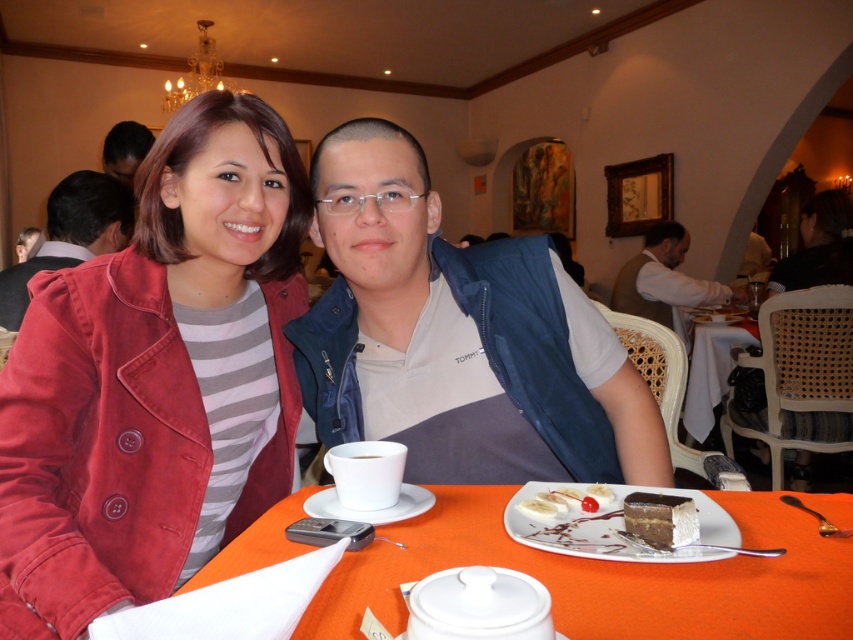
You are a photographer standing at the camera position. You want to place a small decorative item on the table so that it is exactly 30 inches away from the camera. Given the current setup, can you place the item in front of the white ceramic plate at lower center?

The white ceramic plate at lower center is currently 27.77 inches away from the camera. To place the decorative item 30 inches away, you would need to move it slightly further away from the camera than the current position of the white ceramic plate at lower center.

You are a waiter in the restaurant and need to place a small bowl of soup on the table. The bowl has a diameter of 10 cm. The table is 1.2 meters wide. The white ceramic plate at lower center is located at point (x=614, y=528). Can you place the bowl on the table without it overlapping the white ceramic plate at lower center?

The point (x=614, y=528) is on the white ceramic plate at lower center. Since the bowl has a diameter of 10 cm and the table is 1.2 meters wide, there is sufficient space to place the bowl elsewhere on the table without overlapping the white ceramic plate at lower center.

Based on the photo, you are a waiter in a restaurant and need to place a 15 cm wide dessert plate between the white ceramic saucer at lower center and the smooth chocolate cake at center. Can the dessert plate fit in the space between them?

The distance between the white ceramic saucer at lower center and the smooth chocolate cake at center is 18.02 centimeters. Since the dessert plate is 15 cm wide, it can fit in the space between them as 15 cm is less than 18.02 cm.